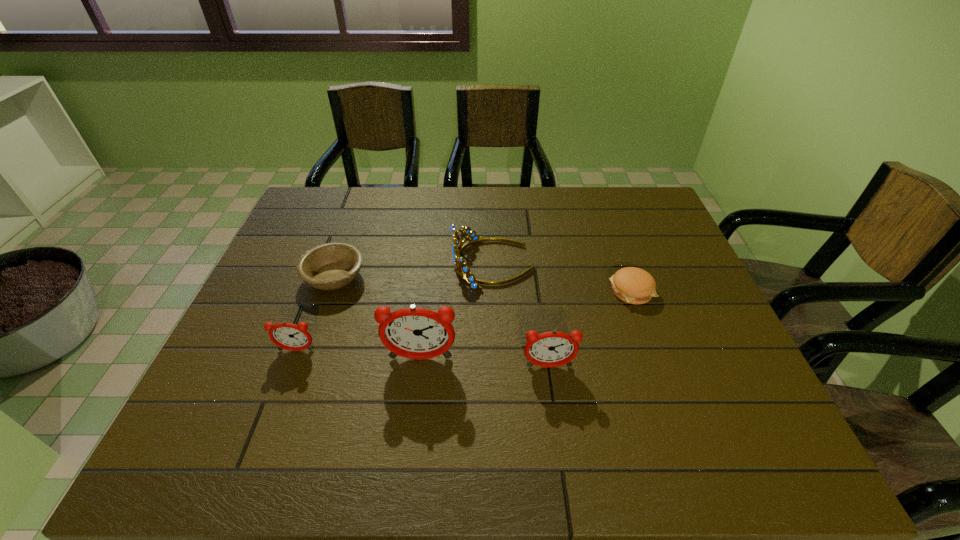
Image resolution: width=960 pixels, height=540 pixels. I want to click on free space between the rightmost object and the tiara, so click(563, 278).

Where is `free area in between the rightmost object and the tiara`? Image resolution: width=960 pixels, height=540 pixels. free area in between the rightmost object and the tiara is located at coordinates click(x=563, y=278).

The image size is (960, 540). In order to click on free area in between the tiara and the rightmost object in this screenshot , I will do `click(563, 278)`.

Point out which object is positioned as the fourth nearest to the bowl. Please provide its 2D coordinates. Your answer should be formatted as a tuple, i.e. [(x, y)], where the tuple contains the x and y coordinates of a point satisfying the conditions above.

[(549, 349)]

Find the location of a particular element. object that is the second closest to the tallest alarm clock is located at coordinates (288, 336).

Choose which alarm clock is the second nearest neighbor to the second tallest alarm clock. Please provide its 2D coordinates. Your answer should be formatted as a tuple, i.e. [(x, y)], where the tuple contains the x and y coordinates of a point satisfying the conditions above.

[(288, 336)]

This screenshot has width=960, height=540. In order to click on alarm clock that is the closest one to the third shortest object in this screenshot , I will do `click(416, 333)`.

Where is `free region that satisfies the following two spatial constraints: 1. on the front-facing side of the rightmost object; 2. on the left side of the tiara`? The height and width of the screenshot is (540, 960). free region that satisfies the following two spatial constraints: 1. on the front-facing side of the rightmost object; 2. on the left side of the tiara is located at coordinates (494, 291).

This screenshot has width=960, height=540. I want to click on free space that satisfies the following two spatial constraints: 1. on the front-facing side of the tiara; 2. on the front-facing side of the leftmost alarm clock, so (496, 350).